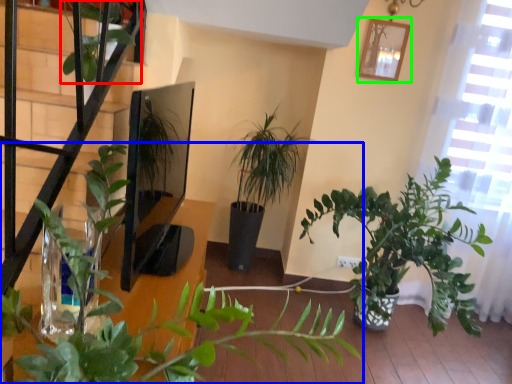
Question: Which object is positioned farthest from vegetation (highlighted by a red box)? Select from houseplant (highlighted by a blue box) and picture frame (highlighted by a green box).

Choices:
 (A) houseplant
 (B) picture frame

Answer: (B)